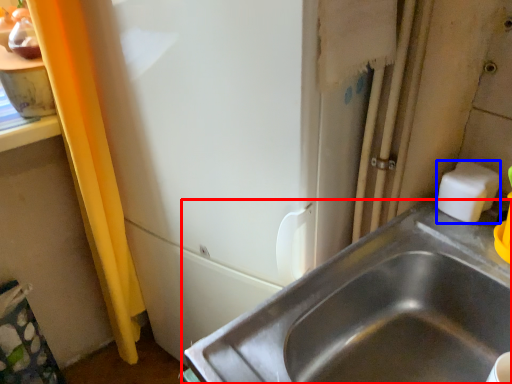
Question: Which of the following is the farthest to the observer, sink (highlighted by a red box) or soap (highlighted by a blue box)?

Choices:
 (A) sink
 (B) soap

Answer: (B)